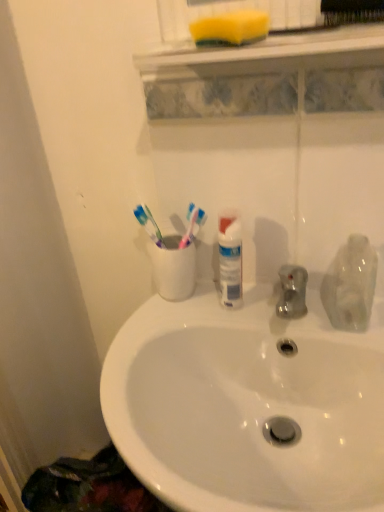
Question: Does black bristle brush at upper center lie in front of yellow sponge at upper center?

Choices:
 (A) no
 (B) yes

Answer: (A)

Question: From a real-world perspective, does black bristle brush at upper center stand above yellow sponge at upper center?

Choices:
 (A) yes
 (B) no

Answer: (A)

Question: Is black bristle brush at upper center at the right side of yellow sponge at upper center?

Choices:
 (A) yes
 (B) no

Answer: (A)

Question: Does black bristle brush at upper center have a larger size compared to yellow sponge at upper center?

Choices:
 (A) no
 (B) yes

Answer: (A)

Question: Can you confirm if black bristle brush at upper center is thinner than yellow sponge at upper center?

Choices:
 (A) yes
 (B) no

Answer: (A)

Question: In terms of size, does white glossy sink at center appear bigger or smaller than yellow sponge at upper center?

Choices:
 (A) big
 (B) small

Answer: (A)

Question: Considering the positions of white glossy sink at center and yellow sponge at upper center in the image, is white glossy sink at center taller or shorter than yellow sponge at upper center?

Choices:
 (A) tall
 (B) short

Answer: (A)

Question: Is white glossy sink at center in front of or behind yellow sponge at upper center in the image?

Choices:
 (A) front
 (B) behind

Answer: (A)

Question: Considering the positions of point (261, 314) and point (185, 58), is point (261, 314) closer or farther from the camera than point (185, 58)?

Choices:
 (A) closer
 (B) farther

Answer: (B)

Question: In terms of width, does yellow sponge at upper center look wider or thinner when compared to yellow sponge at upper center?

Choices:
 (A) thin
 (B) wide

Answer: (B)

Question: Is yellow sponge at upper center inside or outside of yellow sponge at upper center?

Choices:
 (A) inside
 (B) outside

Answer: (B)

Question: In the image, is yellow sponge at upper center positioned in front of or behind yellow sponge at upper center?

Choices:
 (A) behind
 (B) front

Answer: (B)

Question: From the image's perspective, is yellow sponge at upper center positioned above or below yellow sponge at upper center?

Choices:
 (A) above
 (B) below

Answer: (B)

Question: From the image's perspective, is transparent plastic bottle at right above or below yellow sponge at upper center?

Choices:
 (A) above
 (B) below

Answer: (B)

Question: From their relative heights in the image, would you say transparent plastic bottle at right is taller or shorter than yellow sponge at upper center?

Choices:
 (A) tall
 (B) short

Answer: (A)